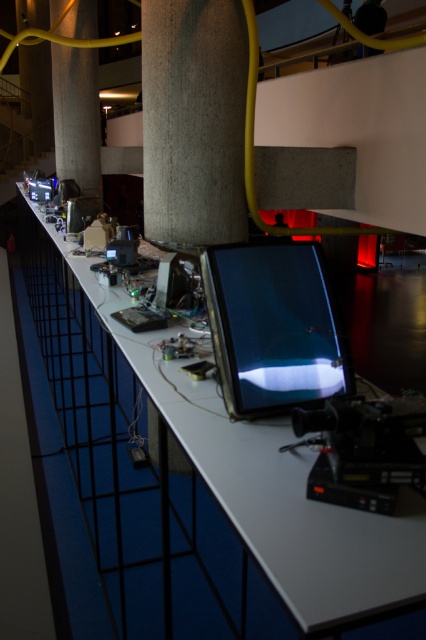
You are an engineer working in the described space. You need to place a new device on the surface between the concrete textured pillar at center and the shiny black tablet at center. Based on their positions, can you determine which object is closer to the edge of the table?

The concrete textured pillar at center is positioned over the shiny black tablet at center, meaning it is closer to the edge of the table. Therefore, the concrete textured pillar at center is closer to the edge than the shiny black tablet at center.

You are a technician working in this space and need to access both the metallic silver table at center and the shiny black tablet at center. Based on their positions, which object is directly above the other?

The shiny black tablet at center is directly above the metallic silver table at center because the metallic silver table at center is positioned under it.